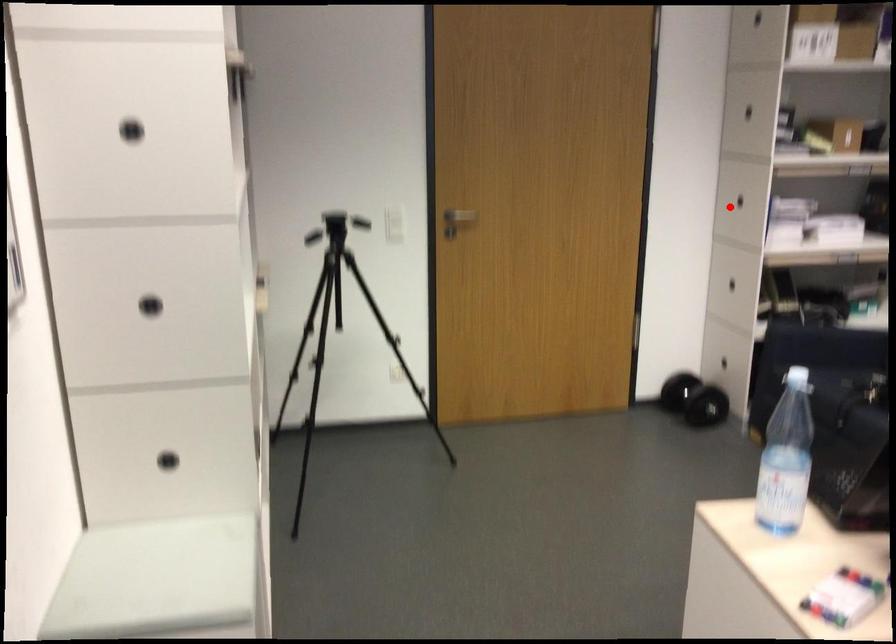
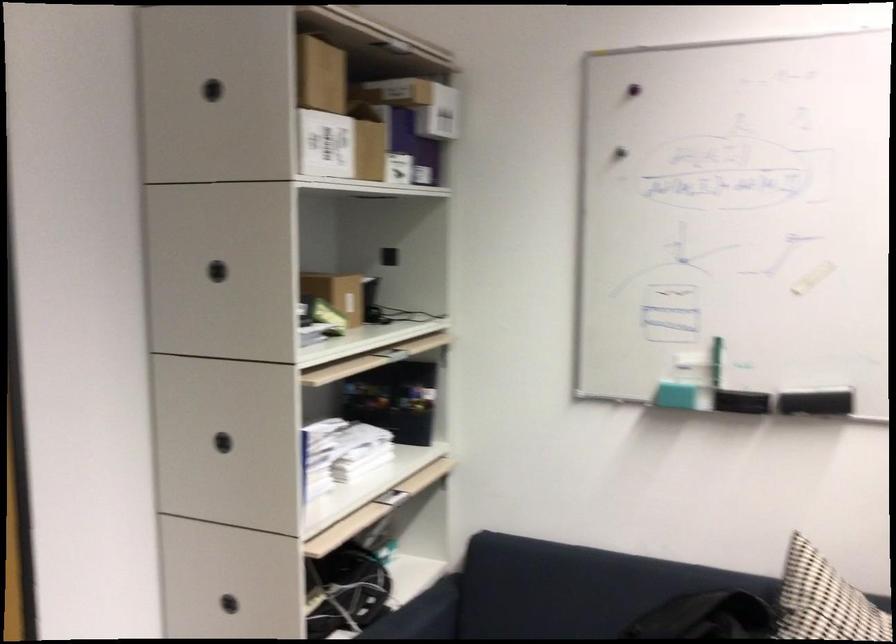
The point at the highlighted location is marked in the first image. Where is the corresponding point in the second image?

(222, 442)